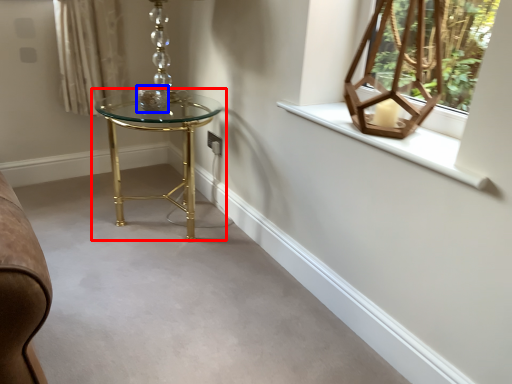
Question: Which object appears farthest to the camera in this image, table (highlighted by a red box) or candle holder (highlighted by a blue box)?

Choices:
 (A) table
 (B) candle holder

Answer: (B)